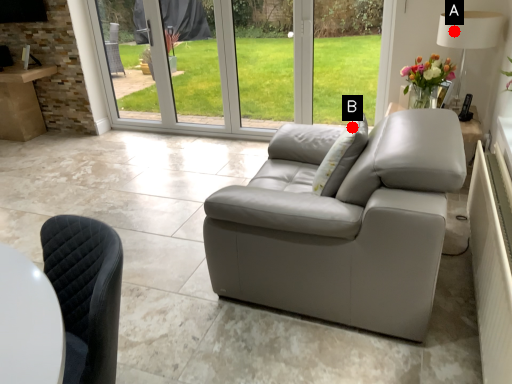
Question: Two points are circled on the image, labeled by A and B beside each circle. Which point is further to the camera?

Choices:
 (A) A is further
 (B) B is further

Answer: (A)